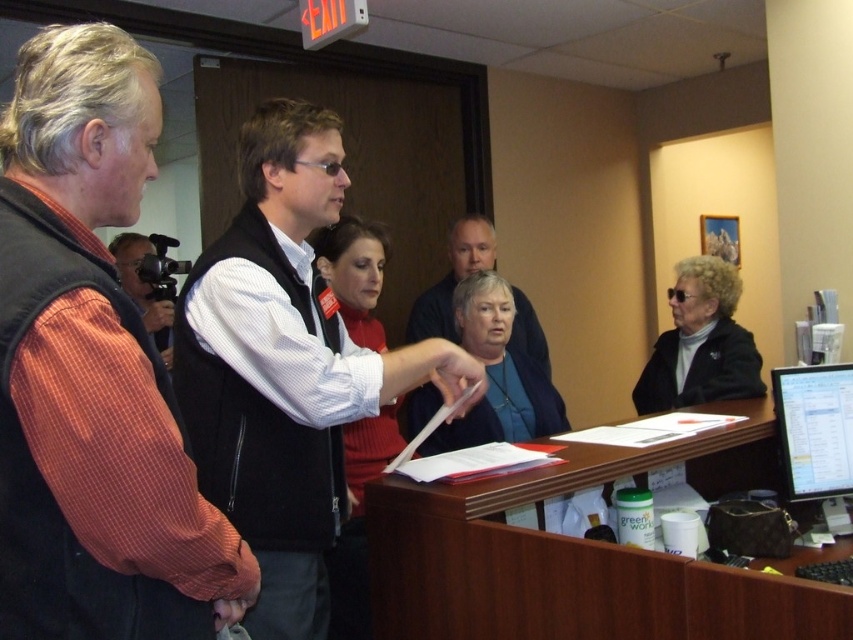
Question: Based on their relative distances, which object is farther from the orange striped shirt at left?

Choices:
 (A) black glossy monitor at center right
 (B) white shirt at center
 (C) red striped shirt at left

Answer: (A)

Question: Among these points, which one is farthest from the camera?

Choices:
 (A) (381, 561)
 (B) (267, 326)
 (C) (822, 406)

Answer: (C)

Question: Does white shirt at center appear on the left side of black matte jacket at lower right?

Choices:
 (A) yes
 (B) no

Answer: (A)

Question: Which point is farther from the camera taking this photo?

Choices:
 (A) (819, 448)
 (B) (532, 346)
 (C) (239, 212)

Answer: (B)

Question: From the image, what is the correct spatial relationship of red striped shirt at left in relation to black matte jacket at lower right?

Choices:
 (A) right
 (B) left

Answer: (B)

Question: Does red striped shirt at left lie behind matte black vest at center?

Choices:
 (A) yes
 (B) no

Answer: (B)